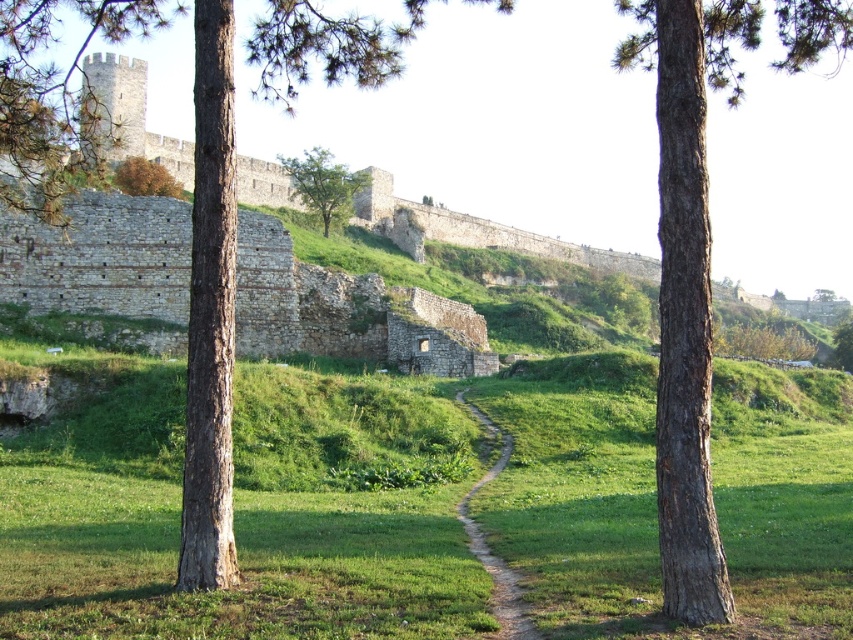
You are a hiker who wants to walk along the dirt path at center without stepping on the green leafy tree at center. Is the path wide enough for you to walk on safely?

The dirt path at center is thinner than the green leafy tree at center, so the path may not be wide enough for safe passage. Consider taking a different route to avoid the tree.

You are standing in the middle of the historical stone wall and see the green grassy at center and the green leafy tree at center. Which object is positioned to the right of the other?

The green grassy at center is to the right of the green leafy tree at center.

You are a landscape architect planning to install a small garden between the green grassy at center and the green leafy tree at center. Given that the garden requires a minimum of 200 feet of space between the tree and the grassy area to thrive, will the existing distance suffice?

The distance between the green grassy at center and the green leafy tree at center is 279.68 feet, which exceeds the required 200 feet. Therefore, the existing distance is sufficient for the garden to thrive.